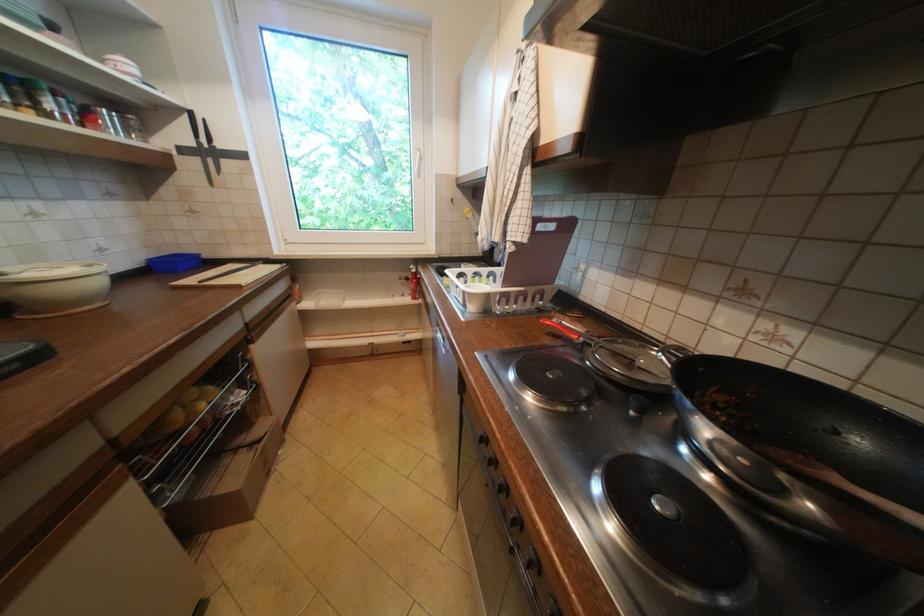
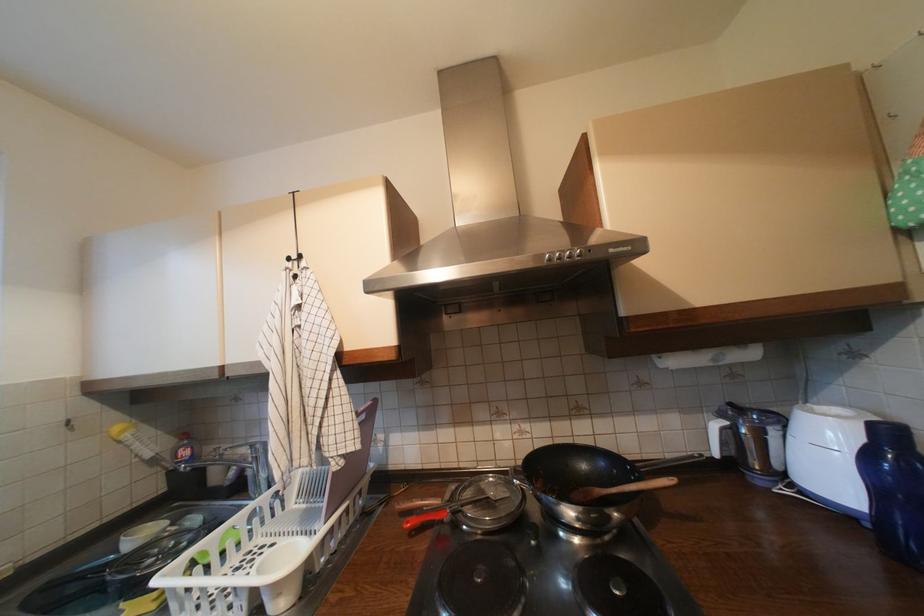
Question: The camera is either moving clockwise (left) or counter-clockwise (right) around the object. The first image is from the beginning of the video and the second image is from the end. Is the camera moving left or right when shooting the video?

Choices:
 (A) Left
 (B) Right

Answer: (A)